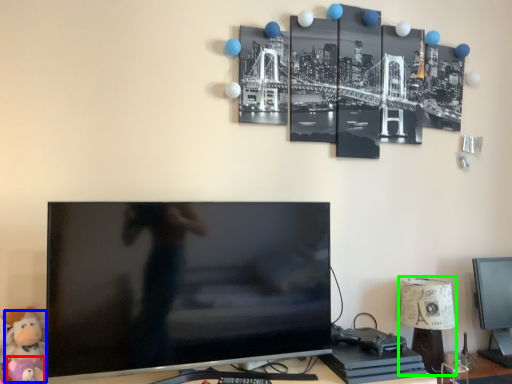
Question: Estimate the real-world distances between objects in this image. Which object is farther from toy (highlighted by a red box), toy (highlighted by a blue box) or table lamp (highlighted by a green box)?

Choices:
 (A) toy
 (B) table lamp

Answer: (B)